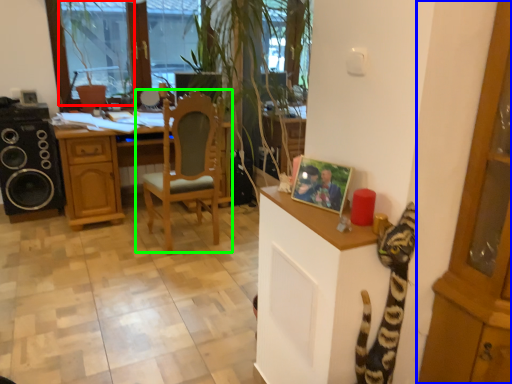
Question: Which object is positioned farthest from window screen (highlighted by a red box)? Select from cabinetry (highlighted by a blue box) and chair (highlighted by a green box).

Choices:
 (A) cabinetry
 (B) chair

Answer: (A)